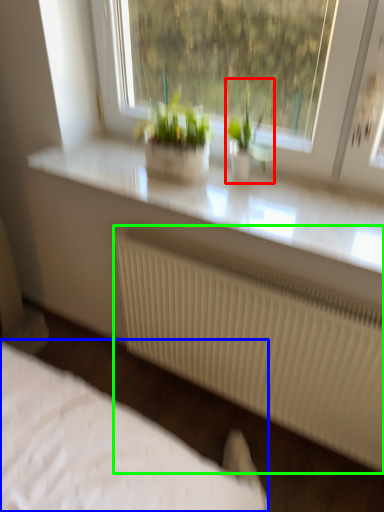
Question: Which object is the farthest from houseplant (highlighted by a red box)? Choose among these: bed (highlighted by a blue box) or radiator (highlighted by a green box).

Choices:
 (A) bed
 (B) radiator

Answer: (A)